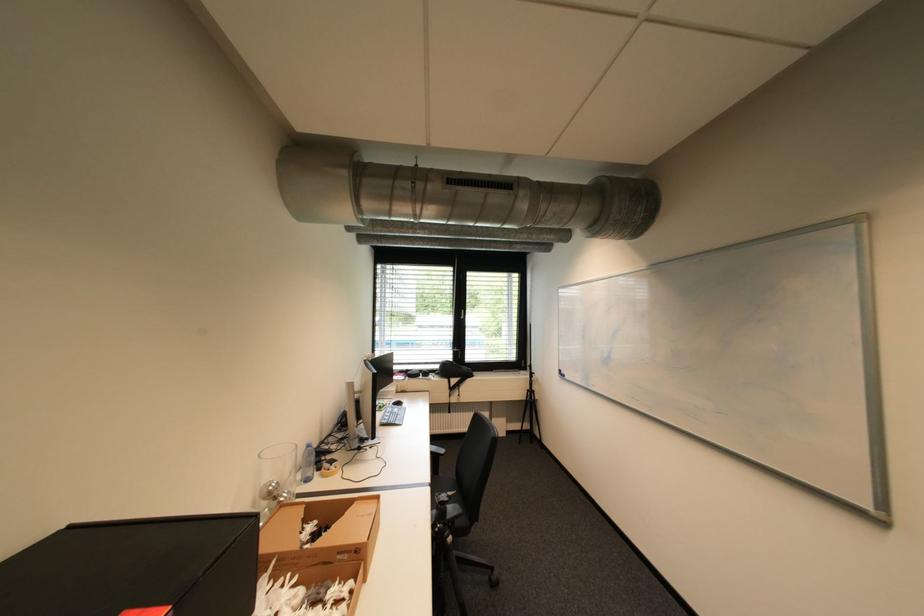
The location [454,370] corresponds to which object?

It refers to a black bag.